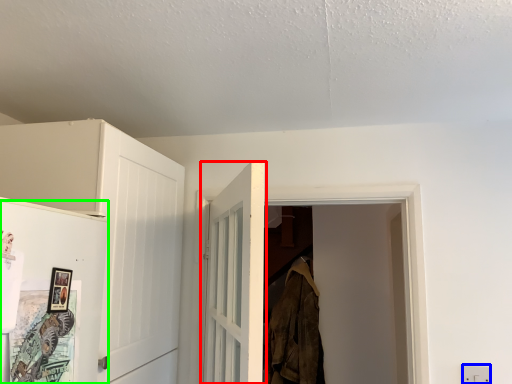
Question: Based on their relative distances, which object is farther from door (highlighted by a red box)? Choose from electric outlet (highlighted by a blue box) and door (highlighted by a green box).

Choices:
 (A) electric outlet
 (B) door

Answer: (A)